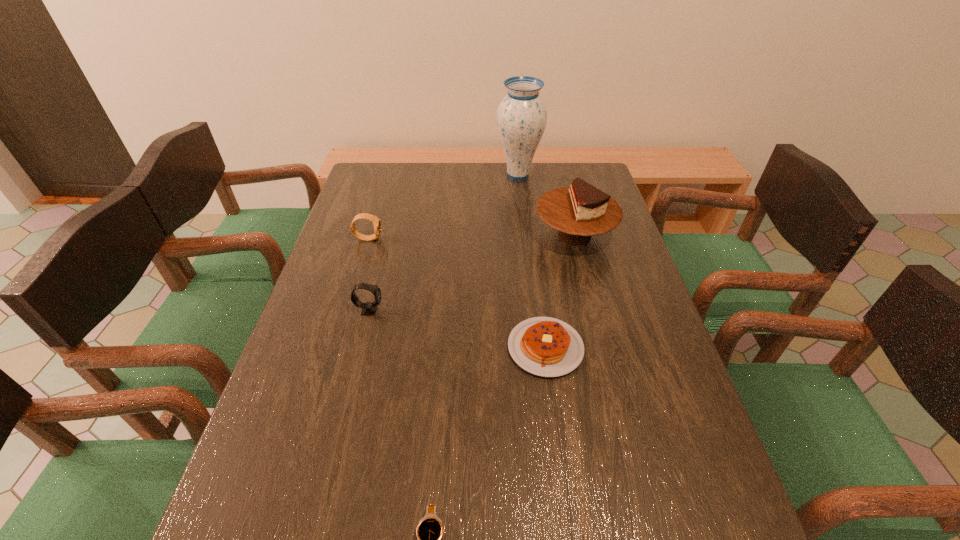
Image resolution: width=960 pixels, height=540 pixels. In order to click on vacant space located on the face of the farthest watch in this screenshot , I will do `click(446, 238)`.

Find the location of a particular element. The height and width of the screenshot is (540, 960). free space located 0.090m on the left of the fifth farthest object is located at coordinates (470, 348).

Locate an element on the screen. The width and height of the screenshot is (960, 540). object at the far edge is located at coordinates (521, 117).

This screenshot has height=540, width=960. Identify the location of object that is at the right edge. click(x=580, y=211).

This screenshot has width=960, height=540. I want to click on vacant position at the far edge of the desktop, so tap(415, 173).

In the image, there is a desktop. At what (x,y) coordinates should I click in order to perform the action: click on free space at the left edge. Please return your answer as a coordinate pair (x, y). The width and height of the screenshot is (960, 540). Looking at the image, I should click on (325, 259).

Identify the location of blank space at the right edge of the desktop. (627, 313).

I want to click on empty space between the cake and the farthest watch, so click(471, 237).

Find the location of `free space between the second farthest watch and the farthest watch`. free space between the second farthest watch and the farthest watch is located at coordinates (369, 274).

This screenshot has height=540, width=960. I want to click on vacant point located between the second shortest object and the farthest watch, so click(x=457, y=293).